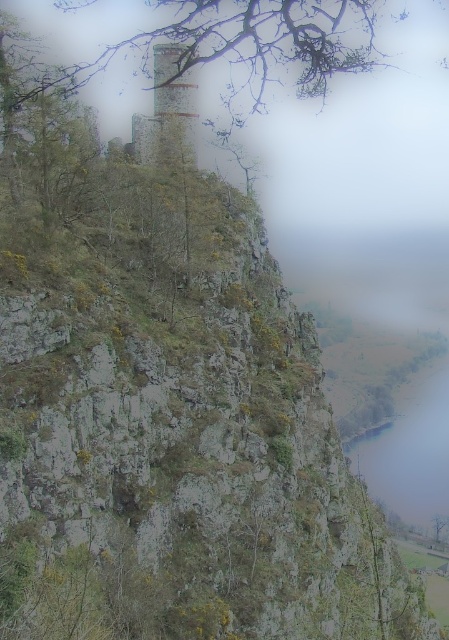
You are a hiker with a 20 meter long rope. You want to climb from the bare branches at upper center down to the rustic stone tower at center. Is your rope long enough?

The distance between the bare branches at upper center and the rustic stone tower at center is 22.67 meters, so the 20 meter rope is not long enough.

You are a bird seeking a perch. You see the bare branches at upper center and the rustic stone tower at center. Which one is wider in terms of their width?

The bare branches at upper center are wider than the rustic stone tower at center.

You are a bird looking for a place to perch. You see the bare branches at upper center and the rustic stone tower at center. Which one is higher up in the scene?

The bare branches at upper center are taller than the rustic stone tower at center, so the bare branches at upper center are higher up in the scene.